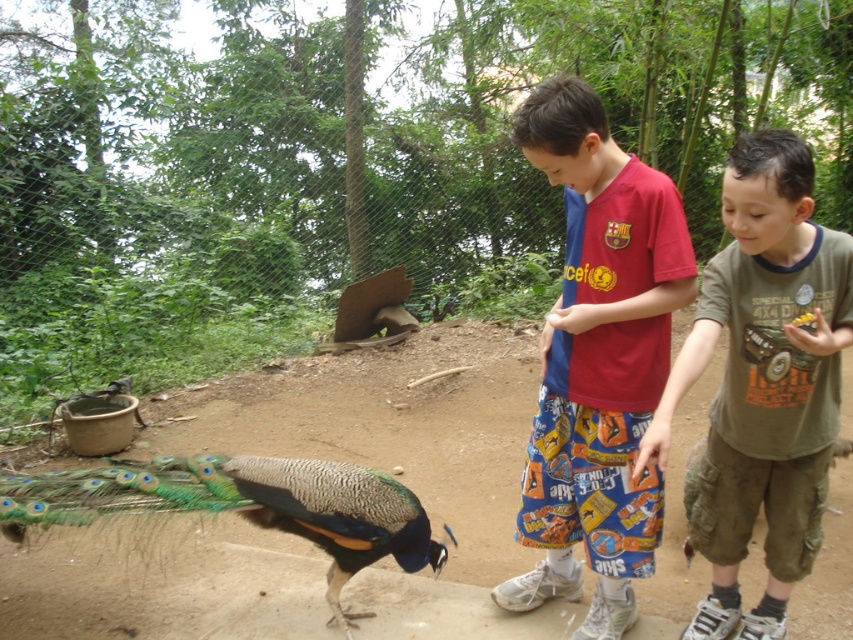
Question: Which object appears farthest from the camera in this image?

Choices:
 (A) shiny iridescent peacock at lower left
 (B) green cargo shorts at lower right

Answer: (A)

Question: Among these points, which one is nearest to the camera?

Choices:
 (A) (424, 531)
 (B) (569, 541)
 (C) (790, 234)

Answer: (C)

Question: Does green cargo shorts at lower right appear over shiny iridescent peacock at lower left?

Choices:
 (A) yes
 (B) no

Answer: (A)

Question: In this image, where is red cotton shirt at center located relative to shiny iridescent peacock at lower left?

Choices:
 (A) left
 (B) right

Answer: (B)

Question: Does red cotton shirt at center appear on the right side of shiny iridescent peacock at lower left?

Choices:
 (A) no
 (B) yes

Answer: (B)

Question: Based on their relative distances, which object is farther from the red cotton shirt at center?

Choices:
 (A) shiny iridescent peacock at lower left
 (B) green cargo shorts at lower right

Answer: (A)